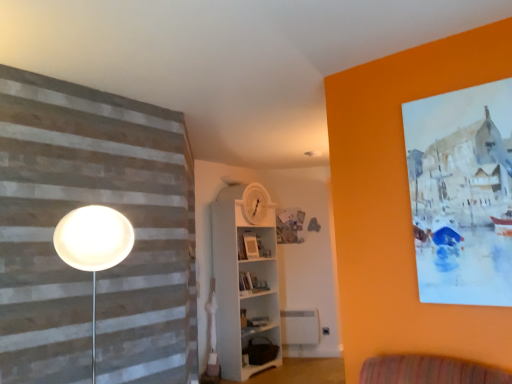
This screenshot has width=512, height=384. What do you see at coordinates (251, 246) in the screenshot? I see `matte white picture frame at center` at bounding box center [251, 246].

In order to face matte white picture frame at center, should I rotate leftwards or rightwards?

To face it directly, rotate left by 0.717 degrees.

At what (x,y) coordinates should I click in order to perform the action: click on brown fabric bag at lower center, which appears as the 2th shelf when viewed from the top. Please return your answer as a coordinate pair (x, y). The width and height of the screenshot is (512, 384). Looking at the image, I should click on point(260,345).

Locate an element on the screen. This screenshot has width=512, height=384. white wooden shelf at center, the second shelf ordered from the bottom is located at coordinates (245, 282).

From the image's perspective, is white wooden shelf at center, the second shelf ordered from the bottom, over brown fabric bag at lower center, marked as the first shelf in a bottom-to-top arrangement?

Indeed, from the image's perspective, white wooden shelf at center, the second shelf ordered from the bottom, is shown above brown fabric bag at lower center, marked as the first shelf in a bottom-to-top arrangement.

Are white wooden shelf at center, which is counted as the first shelf, starting from the top, and brown fabric bag at lower center, marked as the first shelf in a bottom-to-top arrangement, located far from each other?

No, there isn't a large distance between white wooden shelf at center, which is counted as the first shelf, starting from the top, and brown fabric bag at lower center, marked as the first shelf in a bottom-to-top arrangement.

The height and width of the screenshot is (384, 512). I want to click on shelf that appears above the brown fabric bag at lower center, marked as the first shelf in a bottom-to-top arrangement (from the image's perspective), so click(x=245, y=282).

Is white wooden shelf at center, which is counted as the first shelf, starting from the top, facing away from brown fabric bag at lower center, which appears as the 2th shelf when viewed from the top?

Absolutely, white wooden shelf at center, which is counted as the first shelf, starting from the top, is directed away from brown fabric bag at lower center, which appears as the 2th shelf when viewed from the top.

Is matte white picture frame at center not close to white wooden shelf at center, which is counted as the first shelf, starting from the top?

Actually, matte white picture frame at center and white wooden shelf at center, which is counted as the first shelf, starting from the top, are a little close together.

Considering the sizes of matte white picture frame at center and white wooden shelf at center, which is counted as the first shelf, starting from the top, in the image, is matte white picture frame at center taller or shorter than white wooden shelf at center, which is counted as the first shelf, starting from the top,?

In the image, matte white picture frame at center appears to be shorter than white wooden shelf at center, which is counted as the first shelf, starting from the top.

From the image's perspective, does matte white picture frame at center appear lower than white wooden shelf at center, which is counted as the first shelf, starting from the top?

No, from the image's perspective, matte white picture frame at center is not beneath white wooden shelf at center, which is counted as the first shelf, starting from the top.

From a real-world perspective, relative to white wooden shelf at center, the second shelf ordered from the bottom, is matte white picture frame at center vertically above or below?

From a real-world perspective, matte white picture frame at center is physically above white wooden shelf at center, the second shelf ordered from the bottom.

Consider the image. Considering the relative positions of brown fabric bag at lower center, marked as the first shelf in a bottom-to-top arrangement, and white wooden shelf at center, which is counted as the first shelf, starting from the top, in the image provided, is brown fabric bag at lower center, marked as the first shelf in a bottom-to-top arrangement, to the left of white wooden shelf at center, which is counted as the first shelf, starting from the top, from the viewer's perspective?

No.

Is brown fabric bag at lower center, marked as the first shelf in a bottom-to-top arrangement, with white wooden shelf at center, which is counted as the first shelf, starting from the top?

No, brown fabric bag at lower center, marked as the first shelf in a bottom-to-top arrangement, is not touching white wooden shelf at center, which is counted as the first shelf, starting from the top.

Between point (275, 350) and point (249, 337), which one is positioned in front?

The point (249, 337) is closer to the camera.

In terms of size, does brown fabric bag at lower center, marked as the first shelf in a bottom-to-top arrangement, appear bigger or smaller than white wooden shelf at center, which is counted as the first shelf, starting from the top?

Clearly, brown fabric bag at lower center, marked as the first shelf in a bottom-to-top arrangement, is smaller in size than white wooden shelf at center, which is counted as the first shelf, starting from the top.

Would you consider brown fabric bag at lower center, marked as the first shelf in a bottom-to-top arrangement, to be distant from matte white picture frame at center?

Yes, brown fabric bag at lower center, marked as the first shelf in a bottom-to-top arrangement, and matte white picture frame at center are quite far apart.

From a real-world perspective, is brown fabric bag at lower center, which appears as the 2th shelf when viewed from the top, positioned over matte white picture frame at center based on gravity?

No, from a real-world perspective, brown fabric bag at lower center, which appears as the 2th shelf when viewed from the top, is not on top of matte white picture frame at center.

Considering the positions of objects brown fabric bag at lower center, marked as the first shelf in a bottom-to-top arrangement, and matte white picture frame at center in the image provided, who is more to the left, brown fabric bag at lower center, marked as the first shelf in a bottom-to-top arrangement, or matte white picture frame at center?

matte white picture frame at center is more to the left.

Does white wooden shelf at center, the second shelf ordered from the bottom, have a larger size compared to matte white picture frame at center?

Yes, white wooden shelf at center, the second shelf ordered from the bottom, is bigger than matte white picture frame at center.

Considering the sizes of objects white wooden shelf at center, which is counted as the first shelf, starting from the top, and matte white picture frame at center in the image provided, who is shorter, white wooden shelf at center, which is counted as the first shelf, starting from the top, or matte white picture frame at center?

Standing shorter between the two is matte white picture frame at center.

How much distance is there between white wooden shelf at center, the second shelf ordered from the bottom, and matte white picture frame at center?

white wooden shelf at center, the second shelf ordered from the bottom, and matte white picture frame at center are 71.34 centimeters apart.

Relative to matte white picture frame at center, is white wooden shelf at center, the second shelf ordered from the bottom, in front or behind?

In the image, white wooden shelf at center, the second shelf ordered from the bottom, appears in front of matte white picture frame at center.

From the image's perspective, is matte white picture frame at center on top of brown fabric bag at lower center, which appears as the 2th shelf when viewed from the top?

Correct, matte white picture frame at center appears higher than brown fabric bag at lower center, which appears as the 2th shelf when viewed from the top, in the image.

Does point (254, 244) lie behind point (276, 350)?

Yes, it is behind point (276, 350).

Is matte white picture frame at center inside or outside of brown fabric bag at lower center, which appears as the 2th shelf when viewed from the top?

matte white picture frame at center is spatially situated outside brown fabric bag at lower center, which appears as the 2th shelf when viewed from the top.

From a real-world perspective, between matte white picture frame at center and brown fabric bag at lower center, marked as the first shelf in a bottom-to-top arrangement, who is vertically higher?

matte white picture frame at center is physically above.

Where is `shelf behind the white wooden shelf at center, which is counted as the first shelf, starting from the top`? Image resolution: width=512 pixels, height=384 pixels. shelf behind the white wooden shelf at center, which is counted as the first shelf, starting from the top is located at coordinates pos(260,345).

Where is `the 1st shelf located beneath the matte white picture frame at center (from a real-world perspective)`? The height and width of the screenshot is (384, 512). the 1st shelf located beneath the matte white picture frame at center (from a real-world perspective) is located at coordinates (245, 282).

Considering their positions, is matte white picture frame at center positioned further to white wooden shelf at center, which is counted as the first shelf, starting from the top, than brown fabric bag at lower center, marked as the first shelf in a bottom-to-top arrangement?

Among the two, matte white picture frame at center is located further to white wooden shelf at center, which is counted as the first shelf, starting from the top.

When comparing their distances from matte white picture frame at center, does brown fabric bag at lower center, marked as the first shelf in a bottom-to-top arrangement, or white wooden shelf at center, the second shelf ordered from the bottom, seem closer?

white wooden shelf at center, the second shelf ordered from the bottom, is closer to matte white picture frame at center.

Estimate the real-world distances between objects in this image. Which object is closer to matte white picture frame at center, white wooden shelf at center, which is counted as the first shelf, starting from the top, or brown fabric bag at lower center, marked as the first shelf in a bottom-to-top arrangement?

white wooden shelf at center, which is counted as the first shelf, starting from the top, is positioned closer to the anchor matte white picture frame at center.

Consider the image. Based on their spatial positions, is brown fabric bag at lower center, which appears as the 2th shelf when viewed from the top, or matte white picture frame at center closer to white wooden shelf at center, the second shelf ordered from the bottom?

Based on the image, brown fabric bag at lower center, which appears as the 2th shelf when viewed from the top, appears to be nearer to white wooden shelf at center, the second shelf ordered from the bottom.

Estimate the real-world distances between objects in this image. Which object is closer to brown fabric bag at lower center, marked as the first shelf in a bottom-to-top arrangement, matte white picture frame at center or white wooden shelf at center, which is counted as the first shelf, starting from the top?

Among the two, white wooden shelf at center, which is counted as the first shelf, starting from the top, is located nearer to brown fabric bag at lower center, marked as the first shelf in a bottom-to-top arrangement.

Considering their positions, is white wooden shelf at center, the second shelf ordered from the bottom, positioned closer to brown fabric bag at lower center, which appears as the 2th shelf when viewed from the top, than matte white picture frame at center?

Based on the image, white wooden shelf at center, the second shelf ordered from the bottom, appears to be nearer to brown fabric bag at lower center, which appears as the 2th shelf when viewed from the top.

Locate an element on the screen. This screenshot has width=512, height=384. shelf between matte white picture frame at center and brown fabric bag at lower center, which appears as the 2th shelf when viewed from the top, vertically is located at coordinates (245, 282).